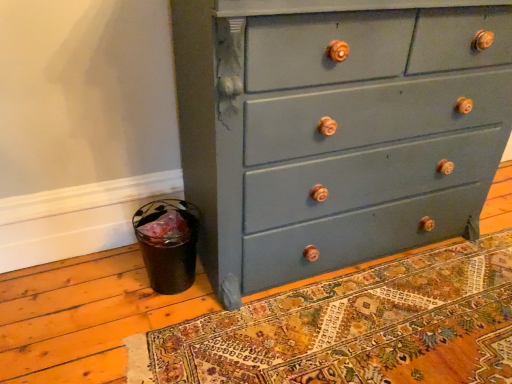
What do you see at coordinates (336, 129) in the screenshot?
I see `matte teal dresser at center` at bounding box center [336, 129].

What is the approximate height of matte teal dresser at center?

1.02 meters.

You are a GUI agent. You are given a task and a screenshot of the screen. Output one action in this format:
    pyautogui.click(x=<x>, y=<y>)
    Task: Click on the matte teal dresser at center
    The image size is (512, 384).
    Given the screenshot: What is the action you would take?
    pyautogui.click(x=336, y=129)

In order to click on matte teal dresser at center in this screenshot , I will do `click(336, 129)`.